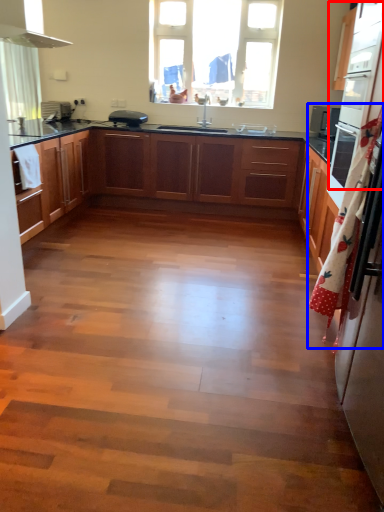
Question: Which point is closer to the camera, oven (highlighted by a red box) or curtain (highlighted by a blue box)?

Choices:
 (A) oven
 (B) curtain

Answer: (B)